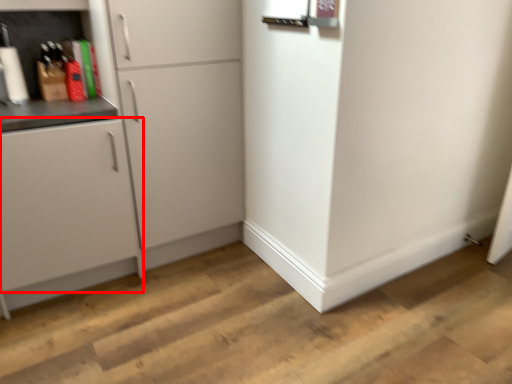
Question: Observing the image, what is the correct spatial positioning of cabinetry (annotated by the red box) in reference to cabinetry?

Choices:
 (A) right
 (B) left

Answer: (B)